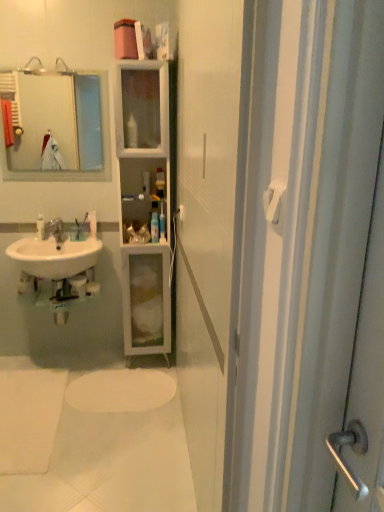
What do you see at coordinates (54, 230) in the screenshot? The width and height of the screenshot is (384, 512). I see `brushed metal faucet at lower left` at bounding box center [54, 230].

What do you see at coordinates (154, 227) in the screenshot? I see `white plastic bottle at center, which appears as the third toiletry when viewed from the left` at bounding box center [154, 227].

Describe the element at coordinates (54, 120) in the screenshot. I see `matte glass mirror at upper left` at that location.

Measure the distance between point (94,211) and camera.

The distance of point (94,211) from camera is 2.78 meters.

This screenshot has width=384, height=512. What do you see at coordinates (92, 223) in the screenshot? I see `clear plastic toothbrush at center, the second toiletry from the left` at bounding box center [92, 223].

Where is `white glossy toothbrush at left, the 1th toiletry in the left-to-right sequence`? white glossy toothbrush at left, the 1th toiletry in the left-to-right sequence is located at coordinates (40, 226).

Identify the location of brushed metal faucet at lower left. (54, 230).

Is white glossy cabinet at center situated inside clear plastic toothbrush at center, which is the third toiletry in right-to-left order, or outside?

white glossy cabinet at center is located beyond the bounds of clear plastic toothbrush at center, which is the third toiletry in right-to-left order.

Between point (128, 325) and point (90, 223), which one is positioned in front?

Point (128, 325)

From a real-world perspective, is white glossy cabinet at center below clear plastic toothbrush at center, which is the third toiletry in right-to-left order?

Incorrect, from a real-world perspective, white glossy cabinet at center is higher than clear plastic toothbrush at center, which is the third toiletry in right-to-left order.

Is white matte oval mat at lower center positioned in front of white glossy toothbrush at left, acting as the fourth toiletry starting from the right?

Yes, it is.

From a real-world perspective, relative to white glossy toothbrush at left, acting as the fourth toiletry starting from the right, is white matte oval mat at lower center vertically above or below?

In terms of real-world spatial position, white matte oval mat at lower center is below white glossy toothbrush at left, acting as the fourth toiletry starting from the right.

Would you say matte glass mirror at upper left is outside white glossy cabinet at center?

That's correct, matte glass mirror at upper left is outside of white glossy cabinet at center.

From the image's perspective, who appears lower, matte glass mirror at upper left or white glossy cabinet at center?

white glossy cabinet at center.

From a real-world perspective, relative to white glossy cabinet at center, is matte glass mirror at upper left vertically above or below?

In terms of real-world spatial position, matte glass mirror at upper left is above white glossy cabinet at center.

Between matte glass mirror at upper left and white glossy cabinet at center, which one has less height?

matte glass mirror at upper left is shorter.

How far apart are matte glass mirror at upper left and translucent plastic bottle at center, which appears as the first toiletry when viewed from the right?

matte glass mirror at upper left and translucent plastic bottle at center, which appears as the first toiletry when viewed from the right, are 2.15 meters apart from each other.

Is matte glass mirror at upper left taller or shorter than translucent plastic bottle at center, which appears as the first toiletry when viewed from the right?

Considering their sizes, matte glass mirror at upper left has more height than translucent plastic bottle at center, which appears as the first toiletry when viewed from the right.

Considering the positions of objects matte glass mirror at upper left and translucent plastic bottle at center, the 4th toiletry viewed from the left, in the image provided, who is more to the left, matte glass mirror at upper left or translucent plastic bottle at center, the 4th toiletry viewed from the left,?

matte glass mirror at upper left is more to the left.

Is matte glass mirror at upper left wider or thinner than translucent plastic bottle at center, the 4th toiletry viewed from the left?

In the image, matte glass mirror at upper left appears to be more narrow than translucent plastic bottle at center, the 4th toiletry viewed from the left.

How many degrees apart are the facing directions of white glossy cabinet at center and translucent plastic bottle at center, the 4th toiletry viewed from the left?

0.205 degrees separate the facing orientations of white glossy cabinet at center and translucent plastic bottle at center, the 4th toiletry viewed from the left.

Is white glossy cabinet at center looking in the opposite direction of translucent plastic bottle at center, which appears as the first toiletry when viewed from the right?

Correct, white glossy cabinet at center is looking away from translucent plastic bottle at center, which appears as the first toiletry when viewed from the right.

Is white glossy cabinet at center not within translucent plastic bottle at center, which appears as the first toiletry when viewed from the right?

That's correct, white glossy cabinet at center is outside of translucent plastic bottle at center, which appears as the first toiletry when viewed from the right.

From a real-world perspective, is white glossy cabinet at center beneath translucent plastic bottle at center, which appears as the first toiletry when viewed from the right?

Correct, in the physical world, white glossy cabinet at center is lower than translucent plastic bottle at center, which appears as the first toiletry when viewed from the right.

Would you say white glossy cabinet at center is a long distance from matte glass mirror at upper left?

That's right, there is a large distance between white glossy cabinet at center and matte glass mirror at upper left.

Is point (123, 73) positioned in front of point (79, 111)?

Yes, point (123, 73) is closer to viewer.

Which object is positioned more to the left, white glossy cabinet at center or matte glass mirror at upper left?

Positioned to the left is matte glass mirror at upper left.

Which object is positioned more to the right, translucent plastic bottle at center, which appears as the first toiletry when viewed from the right, or white glossy toothbrush at left, the 1th toiletry in the left-to-right sequence?

translucent plastic bottle at center, which appears as the first toiletry when viewed from the right.

Looking at their sizes, would you say translucent plastic bottle at center, the 4th toiletry viewed from the left, is wider or thinner than white glossy toothbrush at left, acting as the fourth toiletry starting from the right?

In the image, translucent plastic bottle at center, the 4th toiletry viewed from the left, appears to be wider than white glossy toothbrush at left, acting as the fourth toiletry starting from the right.

Is point (160, 215) positioned after point (43, 218)?

No.

Consider the image. Is translucent plastic bottle at center, which appears as the first toiletry when viewed from the right, shorter than white glossy toothbrush at left, the 1th toiletry in the left-to-right sequence?

No.

Find the location of a particular element. the 1st toiletry positioned below the white glossy cabinet at center (from a real-world perspective) is located at coordinates (92, 223).

Which toiletry is the 3rd one when counting from the back of the white matte oval mat at lower center? Please provide its 2D coordinates.

[(40, 226)]

When comparing their distances from white glossy sink at lower left, does translucent plastic bottle at center, which appears as the first toiletry when viewed from the right, or clear plastic toothbrush at center, which is the third toiletry in right-to-left order, seem further?

Based on the image, translucent plastic bottle at center, which appears as the first toiletry when viewed from the right, appears to be further to white glossy sink at lower left.

From the image, which object appears to be farther from matte glass mirror at upper left, brushed metal faucet at lower left or white matte oval mat at lower center?

Based on the image, white matte oval mat at lower center appears to be further to matte glass mirror at upper left.

Considering their positions, is white plastic towel bar at upper right positioned closer to brushed metal faucet at lower left than matte glass mirror at upper left?

matte glass mirror at upper left.

In the scene shown: Considering their positions, is brushed metal faucet at lower left positioned closer to white matte oval mat at lower center than matte glass mirror at upper left?

brushed metal faucet at lower left is closer to white matte oval mat at lower center.

From the image, which object appears to be farther from white glossy cabinet at center, clear plastic toothbrush at center, which is the third toiletry in right-to-left order, or matte glass mirror at upper left?

Among the two, matte glass mirror at upper left is located further to white glossy cabinet at center.

Which object lies nearer to the anchor point translucent plastic bottle at center, the 4th toiletry viewed from the left, white glossy sink at lower left or clear plastic toothbrush at center, the second toiletry from the left?

clear plastic toothbrush at center, the second toiletry from the left.

Estimate the real-world distances between objects in this image. Which object is closer to white plastic bottle at center, which appears as the 2th toiletry when viewed from the right, white plastic towel bar at upper right or clear plastic toothbrush at center, which is the third toiletry in right-to-left order?

clear plastic toothbrush at center, which is the third toiletry in right-to-left order, is positioned closer to the anchor white plastic bottle at center, which appears as the 2th toiletry when viewed from the right.

Looking at this image, estimate the real-world distances between objects in this image. Which object is further from white plastic towel bar at upper right, matte glass mirror at upper left or translucent plastic bottle at center, which appears as the first toiletry when viewed from the right?

matte glass mirror at upper left.

Find the location of a particular element. The width and height of the screenshot is (384, 512). tap located between white glossy toothbrush at left, the 1th toiletry in the left-to-right sequence, and translucent plastic bottle at center, which appears as the first toiletry when viewed from the right, in the left-right direction is located at coordinates (54, 230).

Find the location of a particular element. bathroom cabinet located between white glossy sink at lower left and translucent plastic bottle at center, which appears as the first toiletry when viewed from the right, in the left-right direction is located at coordinates (144, 203).

The width and height of the screenshot is (384, 512). Identify the location of sink located between brushed metal faucet at lower left and white plastic bottle at center, which appears as the third toiletry when viewed from the left, in the left-right direction. (55, 256).

Identify the location of sink between brushed metal faucet at lower left and white matte oval mat at lower center vertically. (55, 256).